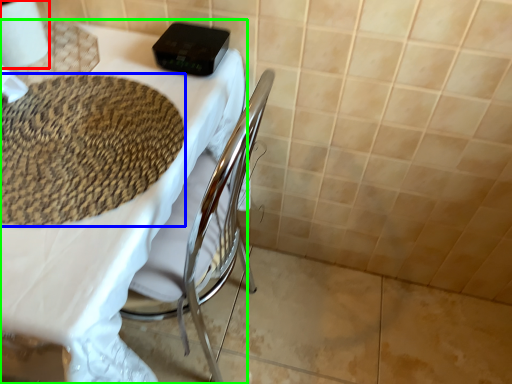
Question: Estimate the real-world distances between objects in this image. Which object is farther from toilet paper (highlighted by a red box), mat (highlighted by a blue box) or table (highlighted by a green box)?

Choices:
 (A) mat
 (B) table

Answer: (B)